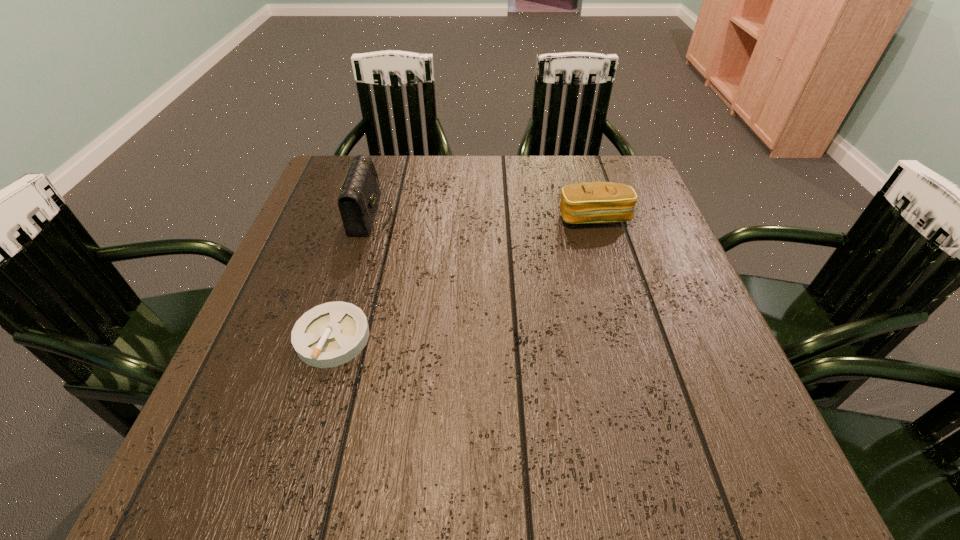
Identify the location of the taller clutch bag. The width and height of the screenshot is (960, 540). (359, 196).

Identify the location of the tallest object. (359, 196).

The width and height of the screenshot is (960, 540). Identify the location of the second shortest object. (591, 202).

This screenshot has width=960, height=540. Find the location of `the rightmost object`. the rightmost object is located at coordinates [591, 202].

At what (x,y) coordinates should I click in order to perform the action: click on the nearest object. Please return your answer as a coordinate pair (x, y). This screenshot has height=540, width=960. Looking at the image, I should click on (331, 334).

Where is `the shortest object`? The image size is (960, 540). the shortest object is located at coordinates (331, 334).

Identify the location of free space located on the front flap of the taller clutch bag. 487,214.

Find the location of a particular element. Image resolution: width=960 pixels, height=540 pixels. vacant position located on the zipper side of the shorter clutch bag is located at coordinates (634, 349).

Identify the location of free spot located 0.110m on the front of the shortest object. The width and height of the screenshot is (960, 540). (306, 426).

This screenshot has height=540, width=960. Identify the location of object situated at the far edge. (359, 196).